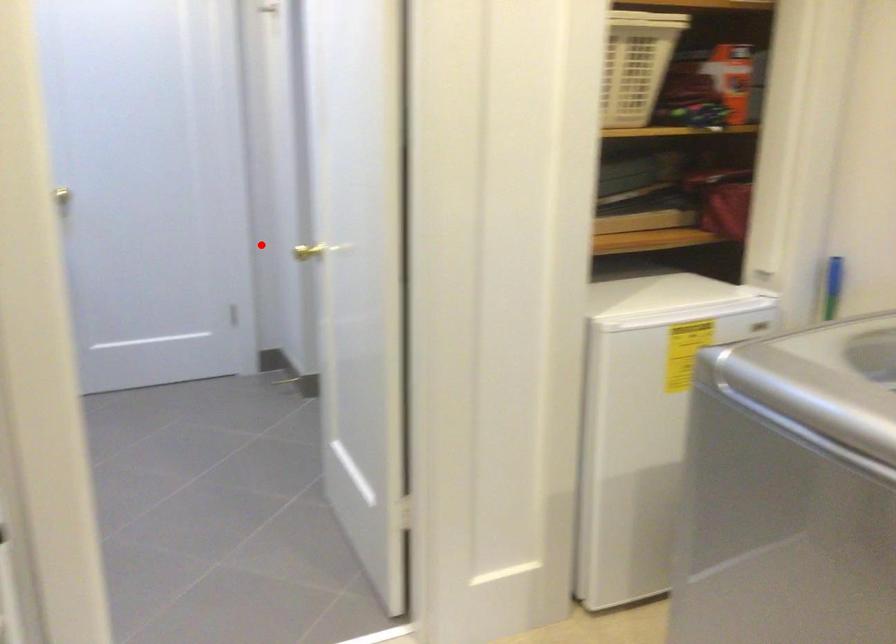
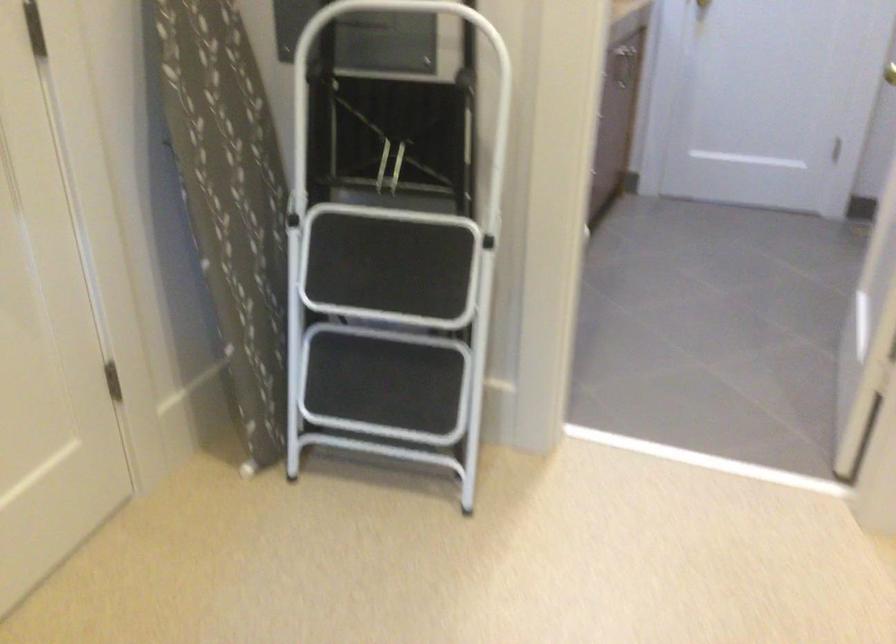
Question: I am providing you with two images of the same scene from different viewpoints. In image1, a red point is highlighted. Considering the same 3D point in image2, which of the following is correct?

Choices:
 (A) It is closer
 (B) It is farther

Answer: (A)